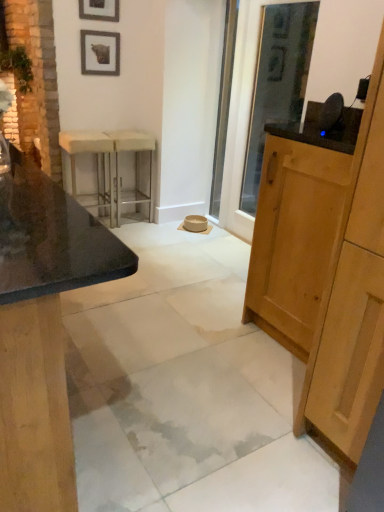
At what (x,y) coordinates should I click in order to perform the action: click on vacant point above white fabric stool at left (from a real-world perspective). Please return your answer as a coordinate pair (x, y). Looking at the image, I should click on (85, 136).